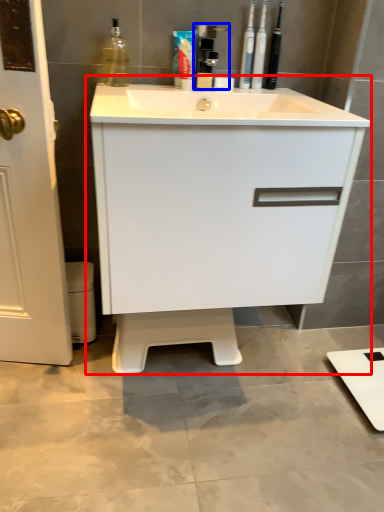
Question: Which object is closer to the camera taking this photo, bathroom cabinet (highlighted by a red box) or faucet (highlighted by a blue box)?

Choices:
 (A) bathroom cabinet
 (B) faucet

Answer: (A)